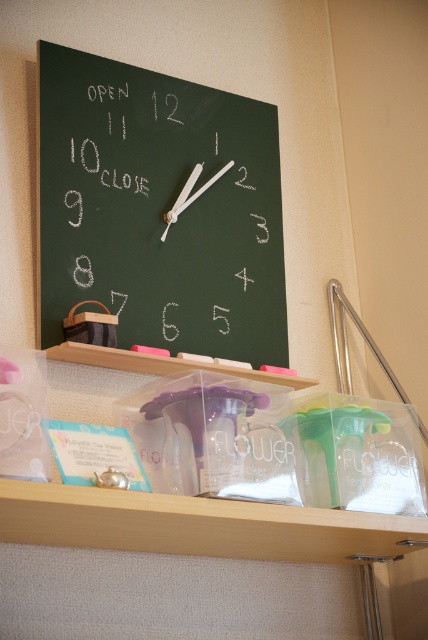
Between chalkboard at upper center and clear plastic shelf at lower center, which one appears on the right side from the viewer's perspective?

clear plastic shelf at lower center is more to the right.

Is point (146, 301) in front of point (219, 499)?

That is False.

Locate an element on the screen. This screenshot has height=640, width=428. chalkboard at upper center is located at coordinates (158, 211).